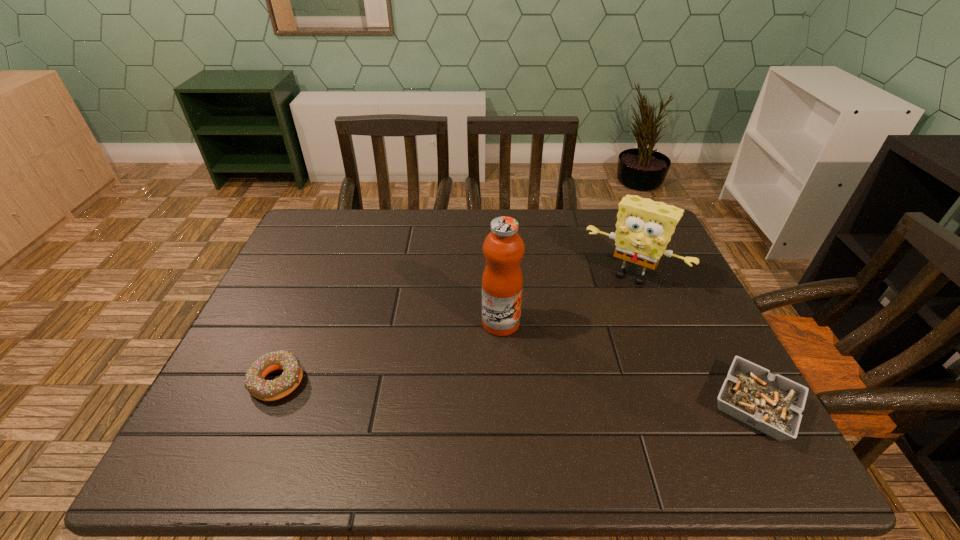
You are a GUI agent. You are given a task and a screenshot of the screen. Output one action in this format:
    pyautogui.click(x=<x>, y=<y>)
    Task: Click on the object that is at the near right corner
    The height and width of the screenshot is (540, 960).
    Given the screenshot: What is the action you would take?
    770,403

In the image, there is a desktop. Where is `blank space at the far edge`? The image size is (960, 540). blank space at the far edge is located at coordinates (481, 232).

Locate an element on the screen. free point at the near edge is located at coordinates (495, 413).

Image resolution: width=960 pixels, height=540 pixels. In order to click on vacant space at the left edge of the desktop in this screenshot , I will do `click(314, 289)`.

Where is `vacant space at the right edge of the desktop`? The width and height of the screenshot is (960, 540). vacant space at the right edge of the desktop is located at coordinates (649, 311).

In the image, there is a desktop. Where is `free space at the far left corner`? free space at the far left corner is located at coordinates (303, 229).

At what (x,y) coordinates should I click in order to perform the action: click on free point at the near right corner. Please return your answer as a coordinate pair (x, y). The height and width of the screenshot is (540, 960). Looking at the image, I should click on pyautogui.click(x=699, y=396).

Image resolution: width=960 pixels, height=540 pixels. Find the location of `unoccupied position between the ashtray and the tallest object`. unoccupied position between the ashtray and the tallest object is located at coordinates (628, 364).

Identify the location of empty location between the farthest object and the third object from right to left. This screenshot has width=960, height=540. (566, 299).

Identify the location of empty space that is in between the doughnut and the ashtray. click(x=516, y=394).